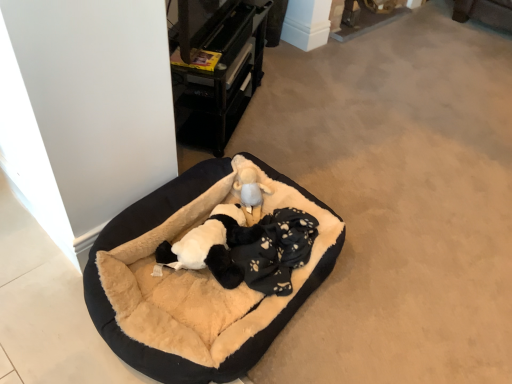
In order to face fluffy beige stuffed animal at center, should I rotate leftwards or rightwards?

You should rotate left by 0.984 degrees.

Locate an element on the screen. black plush dog bed at center is located at coordinates (194, 283).

The width and height of the screenshot is (512, 384). Describe the element at coordinates (194, 283) in the screenshot. I see `black plush dog bed at center` at that location.

Measure the distance between point (222, 212) and camera.

Point (222, 212) and camera are 4.88 feet apart.

Where is `fluffy beige stuffed animal at center`? Image resolution: width=512 pixels, height=384 pixels. fluffy beige stuffed animal at center is located at coordinates (250, 193).

Considering the relative sizes of black plush dog bed at center and black plastic drawer at upper center in the image provided, is black plush dog bed at center bigger than black plastic drawer at upper center?

Yes.

Which is behind, point (143, 283) or point (248, 64)?

The point (248, 64) is farther.

Is black plush dog bed at center at the right side of black plastic drawer at upper center?

Yes.

Does black plush dog bed at center have a lesser width compared to black plastic drawer at upper center?

Incorrect, the width of black plush dog bed at center is not less than that of black plastic drawer at upper center.

From the picture: Could you tell me if black plush dog at center is facing black plush dog bed at center?

Yes, black plush dog at center faces towards black plush dog bed at center.

Between black plush dog at center and black plush dog bed at center, which one has smaller size?

With smaller size is black plush dog at center.

Identify the location of animal above the black plush dog bed at center (from the image's perspective). Image resolution: width=512 pixels, height=384 pixels. (211, 246).

Considering the relative sizes of black plush dog at center and black plush dog bed at center in the image provided, is black plush dog at center wider than black plush dog bed at center?

In fact, black plush dog at center might be narrower than black plush dog bed at center.

Are fluffy beige stuffed animal at center and black plush dog bed at center far apart?

fluffy beige stuffed animal at center is actually quite close to black plush dog bed at center.

Find the location of a particular element. toy above the black plush dog bed at center (from the image's perspective) is located at coordinates (250, 193).

Between point (256, 172) and point (150, 253), which one is positioned behind?

Positioned behind is point (256, 172).

Considering the relative positions of fluffy beige stuffed animal at center and black plush dog bed at center in the image provided, is fluffy beige stuffed animal at center to the right of black plush dog bed at center from the viewer's perspective?

Yes, fluffy beige stuffed animal at center is to the right of black plush dog bed at center.

Is fluffy beige stuffed animal at center positioned in front of black plastic drawer at upper center?

No, fluffy beige stuffed animal at center is further to the viewer.

In the image, is fluffy beige stuffed animal at center on the left side or the right side of black plastic drawer at upper center?

fluffy beige stuffed animal at center is to the right of black plastic drawer at upper center.

Looking at this image, how many degrees apart are the facing directions of fluffy beige stuffed animal at center and black plastic drawer at upper center?

There is a 24.1-degree angle between the facing directions of fluffy beige stuffed animal at center and black plastic drawer at upper center.

From the image's perspective, between fluffy beige stuffed animal at center and black plastic drawer at upper center, who is located below?

fluffy beige stuffed animal at center appears lower in the image.

Looking at this image, between black plastic drawer at upper center and fluffy beige stuffed animal at center, which one has smaller size?

fluffy beige stuffed animal at center.

Can you tell me how much black plastic drawer at upper center and fluffy beige stuffed animal at center differ in facing direction?

black plastic drawer at upper center and fluffy beige stuffed animal at center are facing 24.1 degrees away from each other.

From a real-world perspective, is black plastic drawer at upper center positioned over fluffy beige stuffed animal at center based on gravity?

Yes, from a real-world perspective, black plastic drawer at upper center is over fluffy beige stuffed animal at center

Who is more distant, black plastic drawer at upper center or fluffy beige stuffed animal at center?

fluffy beige stuffed animal at center is further away from the camera.

Between black plush dog bed at center and fluffy beige stuffed animal at center, which one has less height?

fluffy beige stuffed animal at center.

Between black plush dog bed at center and fluffy beige stuffed animal at center, which one is positioned behind?

fluffy beige stuffed animal at center is further from the camera.

Between black plush dog bed at center and fluffy beige stuffed animal at center, which one has larger size?

Bigger between the two is black plush dog bed at center.

Is black plush dog at center inside or outside of black plastic drawer at upper center?

black plush dog at center exists outside the volume of black plastic drawer at upper center.

From the image's perspective, which is above, black plush dog at center or black plastic drawer at upper center?

black plastic drawer at upper center, from the image's perspective.

In the scene shown: Which object is closer to the camera taking this photo, black plush dog at center or black plastic drawer at upper center?

black plush dog at center is closer to the camera.

Which is closer to the camera, (x=157, y=273) or (x=213, y=98)?

Point (x=157, y=273)

Identify the location of furniture above the black plush dog bed at center (from a real-world perspective). (218, 72).

Image resolution: width=512 pixels, height=384 pixels. I want to click on dog bed in front of the black plush dog at center, so click(x=194, y=283).

Looking at the image, which one is located further to black plastic drawer at upper center, black plush dog at center or black plush dog bed at center?

Among the two, black plush dog at center is located further to black plastic drawer at upper center.

Based on their spatial positions, is black plush dog at center or black plastic drawer at upper center further from black plush dog bed at center?

black plastic drawer at upper center lies further to black plush dog bed at center than the other object.

When comparing their distances from fluffy beige stuffed animal at center, does black plush dog at center or black plush dog bed at center seem closer?

black plush dog at center is closer to fluffy beige stuffed animal at center.

From the image, which object appears to be farther from black plush dog bed at center, fluffy beige stuffed animal at center or black plastic drawer at upper center?

Among the two, black plastic drawer at upper center is located further to black plush dog bed at center.

Which object lies further to the anchor point black plush dog at center, black plush dog bed at center or black plastic drawer at upper center?

black plastic drawer at upper center is positioned further to the anchor black plush dog at center.

Which object lies nearer to the anchor point fluffy beige stuffed animal at center, black plastic drawer at upper center or black plush dog at center?

black plush dog at center is closer to fluffy beige stuffed animal at center.

When comparing their distances from black plush dog at center, does black plush dog bed at center or fluffy beige stuffed animal at center seem closer?

Based on the image, black plush dog bed at center appears to be nearer to black plush dog at center.

Based on the photo, based on their spatial positions, is fluffy beige stuffed animal at center or black plastic drawer at upper center closer to black plush dog at center?

fluffy beige stuffed animal at center.

The image size is (512, 384). I want to click on toy between black plastic drawer at upper center and black plush dog at center vertically, so [x=250, y=193].

Identify the location of animal that lies between black plastic drawer at upper center and black plush dog bed at center from top to bottom. (211, 246).

You are a GUI agent. You are given a task and a screenshot of the screen. Output one action in this format:
    pyautogui.click(x=<x>, y=<y>)
    Task: Click on the toy between black plastic drawer at upper center and black plush dog bed at center vertically
    This screenshot has width=512, height=384.
    Given the screenshot: What is the action you would take?
    pyautogui.click(x=250, y=193)

Identify the location of animal between black plush dog bed at center and fluffy beige stuffed animal at center along the z-axis. The image size is (512, 384). (211, 246).